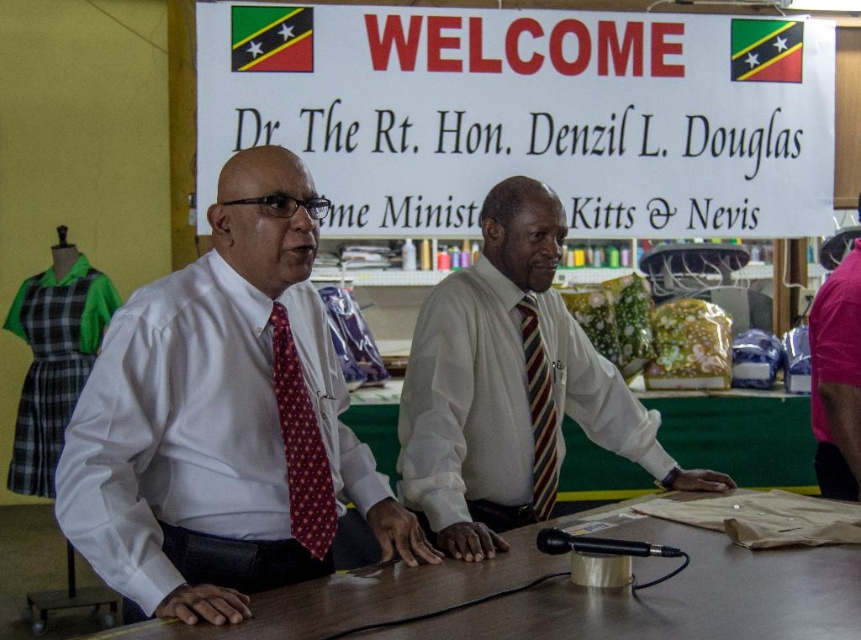
Consider the image. What is the position of the striped fabric tie at center?

The striped fabric tie at center is located at point 0.642 on the x axis and 0.627 on the y axis.